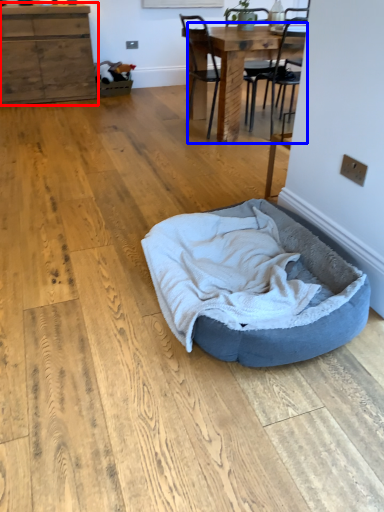
Question: Which of the following is the farthest to the observer, cabinetry (highlighted by a red box) or table (highlighted by a blue box)?

Choices:
 (A) cabinetry
 (B) table

Answer: (A)